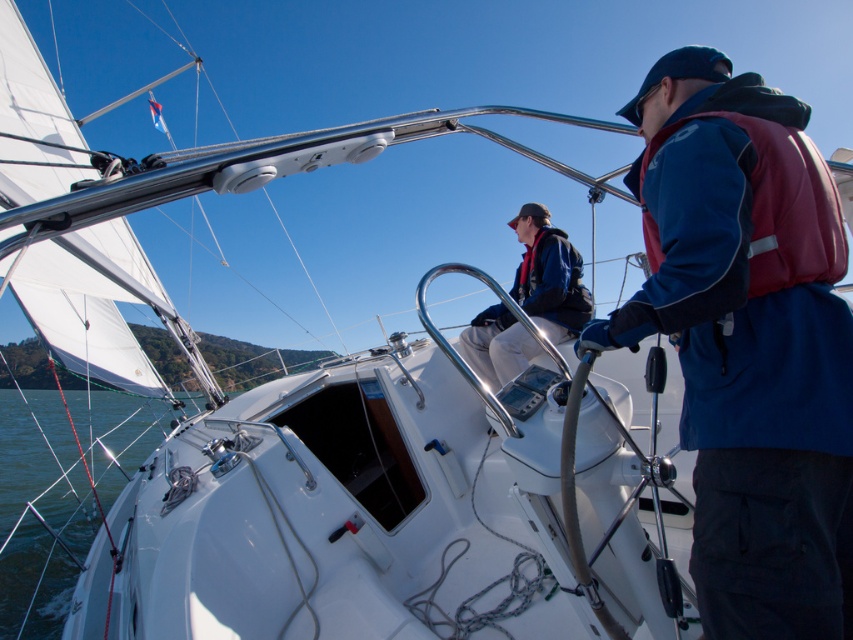
This screenshot has height=640, width=853. What do you see at coordinates (39, 513) in the screenshot?
I see `clear water at lower left` at bounding box center [39, 513].

Does clear water at lower left lie behind blue fabric jacket at center?

No.

Does point (41, 452) come behind point (538, 298)?

Yes, point (41, 452) is behind point (538, 298).

Find the location of a particular element. This screenshot has width=853, height=640. clear water at lower left is located at coordinates (39, 513).

Is maroon synthetic life jacket at right bigger than blue fabric jacket at center?

No, maroon synthetic life jacket at right is not bigger than blue fabric jacket at center.

Is point (653, 230) farther from viewer compared to point (469, 358)?

No, (653, 230) is in front of (469, 358).

This screenshot has width=853, height=640. What do you see at coordinates (773, 205) in the screenshot?
I see `maroon synthetic life jacket at right` at bounding box center [773, 205].

Locate an element on the screen. The height and width of the screenshot is (640, 853). maroon synthetic life jacket at right is located at coordinates (773, 205).

Can you confirm if blue fleece jacket at center is wider than blue fabric jacket at center?

Incorrect, blue fleece jacket at center's width does not surpass blue fabric jacket at center's.

Can you confirm if blue fleece jacket at center is bigger than blue fabric jacket at center?

Incorrect, blue fleece jacket at center is not larger than blue fabric jacket at center.

This screenshot has width=853, height=640. Describe the element at coordinates (747, 340) in the screenshot. I see `blue fleece jacket at center` at that location.

Where is `blue fleece jacket at center`? The width and height of the screenshot is (853, 640). blue fleece jacket at center is located at coordinates (747, 340).